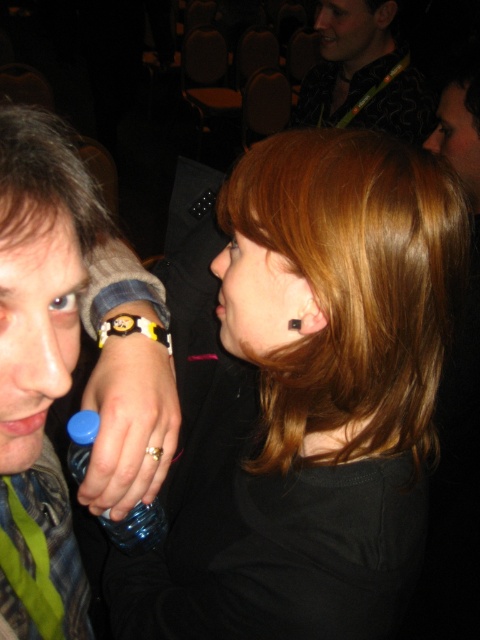
Question: Which point is closer to the camera?

Choices:
 (A) (196, 531)
 (B) (148, 524)

Answer: (A)

Question: Is matte black face at upper center below blue plastic bottle at lower left?

Choices:
 (A) yes
 (B) no

Answer: (B)

Question: Where is matte black ear at center located in relation to matte yellow bracelet at upper left in the image?

Choices:
 (A) right
 (B) left

Answer: (A)

Question: Is gold metallic ring at lower center below smooth skin face at upper right?

Choices:
 (A) no
 (B) yes

Answer: (B)

Question: Which point is closer to the camera taking this photo?

Choices:
 (A) (332, 33)
 (B) (240, 316)
 (C) (90, 433)
 (D) (322, 305)

Answer: (D)

Question: Which point is farther to the camera?

Choices:
 (A) blue plastic bottle at lower left
 (B) matte black face at upper center

Answer: (B)